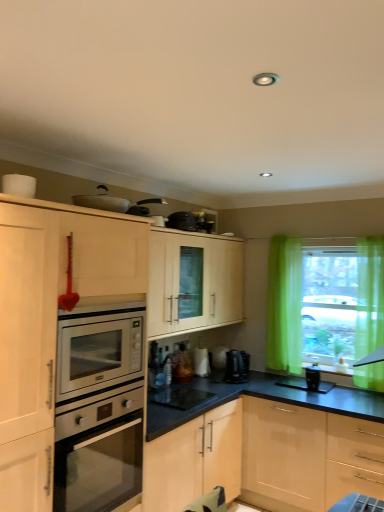
Locate an element on the screen. vacant area that is in front of black plastic coffee machine at center is located at coordinates tap(244, 386).